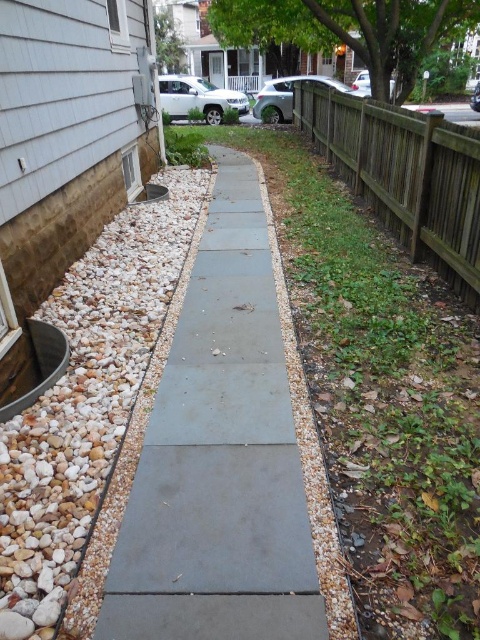
In the scene shown: Can you confirm if white gravel at left is thinner than brown wooden fence at right?

Incorrect, white gravel at left's width is not less than brown wooden fence at right's.

Which is more to the right, white gravel at left or brown wooden fence at right?

brown wooden fence at right

Find the location of a particular element. The width and height of the screenshot is (480, 640). white gravel at left is located at coordinates [86, 401].

Find the location of a particular element. white gravel at left is located at coordinates (86, 401).

How much distance is there between gray concrete path at center and white gravel at left?

18.34 inches

Is gray concrete path at center smaller than white gravel at left?

Correct, gray concrete path at center occupies less space than white gravel at left.

Which is in front, point (170, 356) or point (16, 582)?

Point (16, 582) is in front.

Locate an element on the screen. This screenshot has width=480, height=640. gray concrete path at center is located at coordinates click(x=219, y=458).

Does gray concrete path at center have a smaller size compared to brown wooden fence at right?

Yes.

How distant is gray concrete path at center from brown wooden fence at right?

The distance of gray concrete path at center from brown wooden fence at right is 12.48 feet.

Where is `gray concrete path at center`? The height and width of the screenshot is (640, 480). gray concrete path at center is located at coordinates (219, 458).